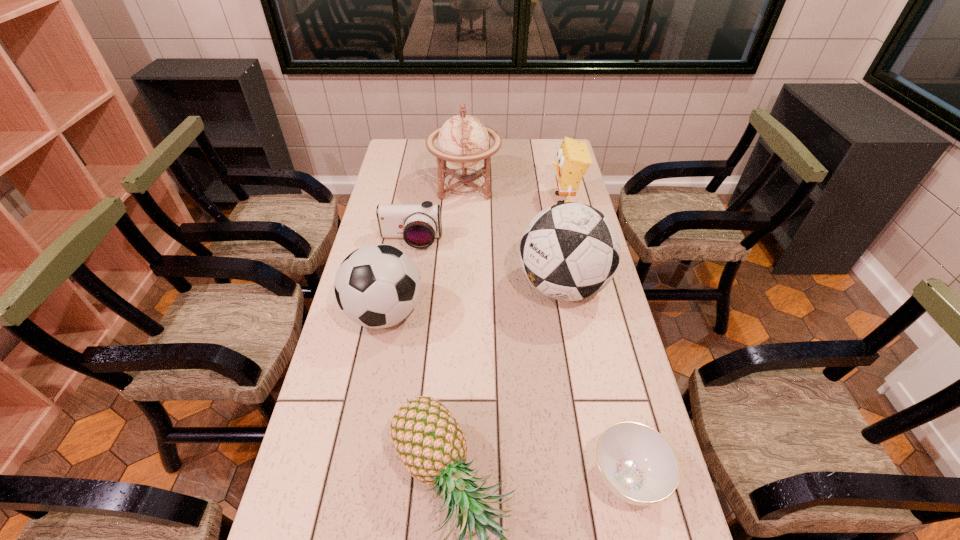
Locate an element on the screen. The height and width of the screenshot is (540, 960). vacant space that's between the chinaware and the sponge is located at coordinates (595, 339).

I want to click on the second closest object to the left soccer ball, so click(427, 438).

The width and height of the screenshot is (960, 540). I want to click on the closest object to the globe, so click(x=419, y=225).

Find the location of a particular element. vacant position in the image that satisfies the following two spatial constraints: 1. on the front-facing side of the tallest object; 2. on the back side of the shortest object is located at coordinates (452, 478).

I want to click on free location that satisfies the following two spatial constraints: 1. on the face of the sponge; 2. on the surface of the sixth tallest object, so click(573, 241).